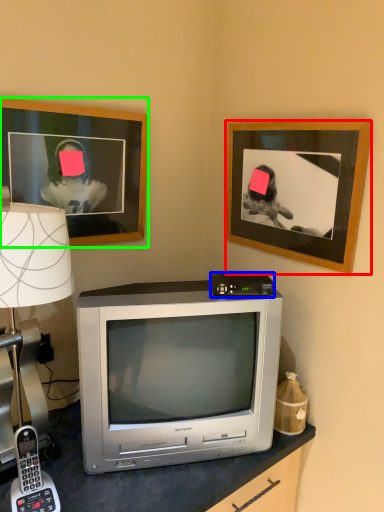
Question: Which object is positioned closest to picture frame (highlighted by a red box)? Select from gadget (highlighted by a blue box) and picture frame (highlighted by a green box).

Choices:
 (A) gadget
 (B) picture frame

Answer: (A)